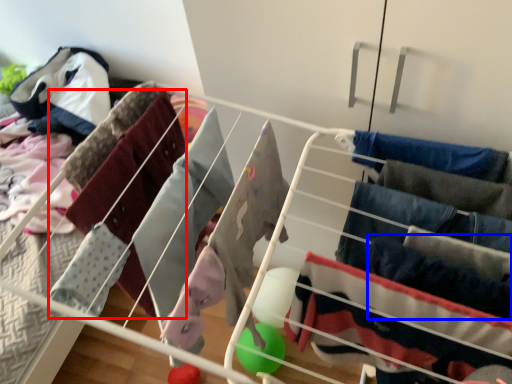
Question: Which object appears closest to the camera in this image, clothing (highlighted by a red box) or clothing (highlighted by a blue box)?

Choices:
 (A) clothing
 (B) clothing

Answer: (B)